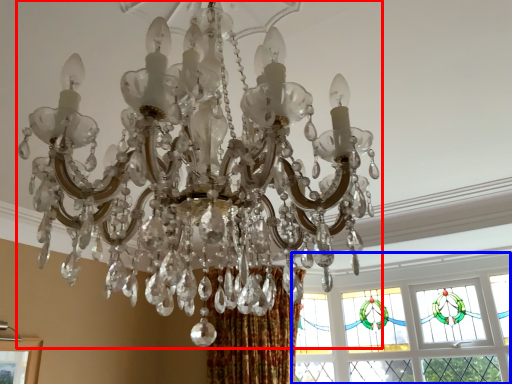
Question: Among these objects, which one is nearest to the camera, lamp (highlighted by a red box) or window (highlighted by a blue box)?

Choices:
 (A) lamp
 (B) window

Answer: (A)